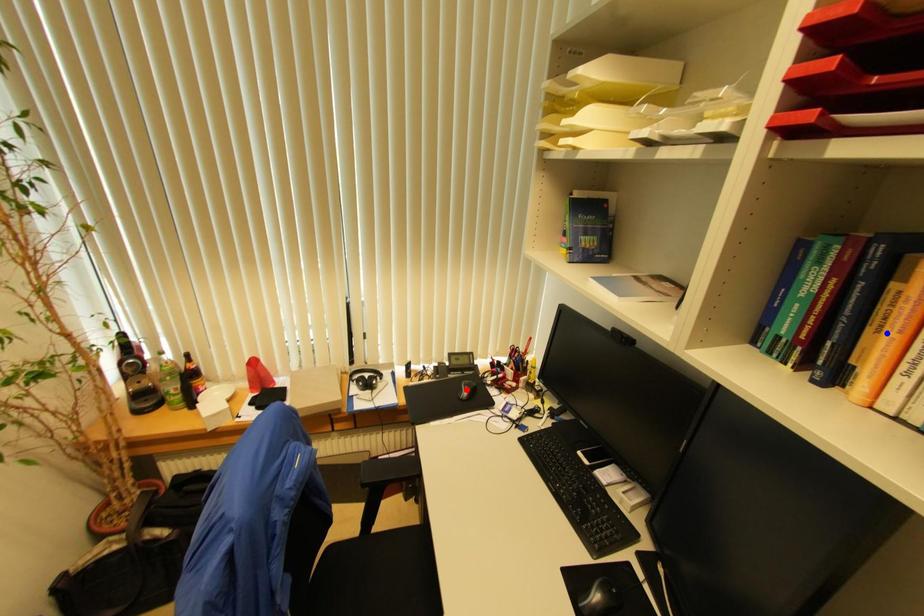
Question: Two points are marked on the image. Which point is closer to the camera?

Choices:
 (A) Blue point is closer.
 (B) Red point is closer.

Answer: (A)